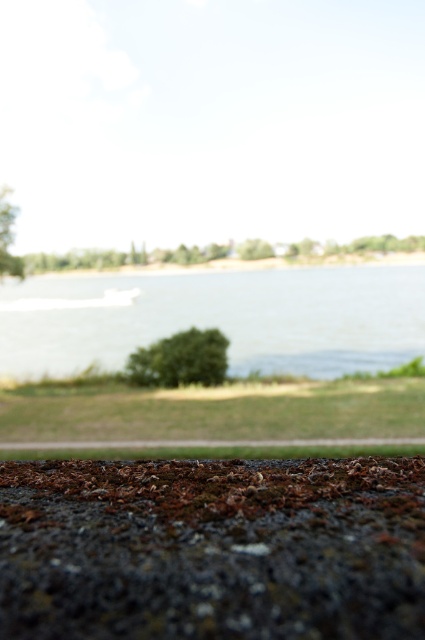
Question: Can you confirm if clear water at center is wider than brown gravel curb at lower center?

Choices:
 (A) yes
 (B) no

Answer: (A)

Question: Is the position of clear water at center less distant than that of brown gravel curb at lower center?

Choices:
 (A) no
 (B) yes

Answer: (A)

Question: Does clear water at center appear under brown gravel curb at lower center?

Choices:
 (A) no
 (B) yes

Answer: (A)

Question: Which point appears farthest from the camera in this image?

Choices:
 (A) (147, 296)
 (B) (323, 444)

Answer: (A)